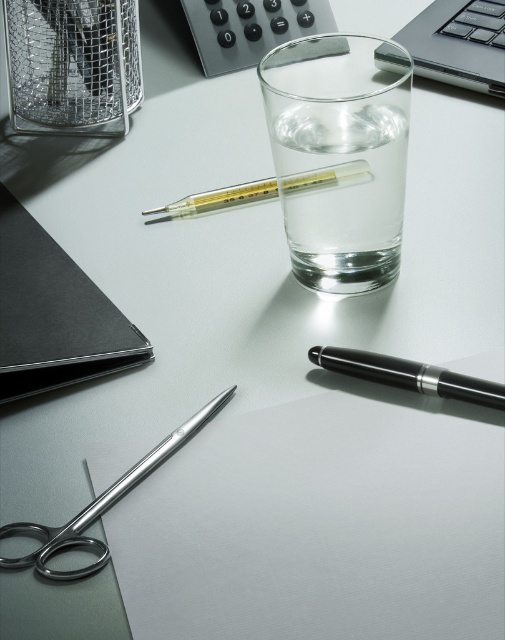
Between transparent glass at center and black plastic calculator at upper center, which one is positioned lower?

transparent glass at center

Is transparent glass at center shorter than black plastic calculator at upper center?

In fact, transparent glass at center may be taller than black plastic calculator at upper center.

Who is more distant from viewer, (x=406, y=97) or (x=212, y=12)?

Point (x=212, y=12)

This screenshot has width=505, height=640. Identify the location of transparent glass at center. point(340,156).

Which of these two, black plastic calculator at upper center or transparent glass thermometer at center, stands shorter?

transparent glass thermometer at center

Find the location of a particular element. This screenshot has width=505, height=640. black plastic calculator at upper center is located at coordinates pos(249,28).

Locate an element on the screen. This screenshot has width=505, height=640. black plastic calculator at upper center is located at coordinates (249, 28).

Is silver metallic laptop at upper right above transparent glass thermometer at center?

Correct, silver metallic laptop at upper right is located above transparent glass thermometer at center.

Is silver metallic laptop at upper right below transparent glass thermometer at center?

Incorrect, silver metallic laptop at upper right is not positioned below transparent glass thermometer at center.

Locate an element on the screen. This screenshot has width=505, height=640. silver metallic laptop at upper right is located at coordinates (459, 44).

Locate an element on the screen. silver metallic laptop at upper right is located at coordinates (459, 44).